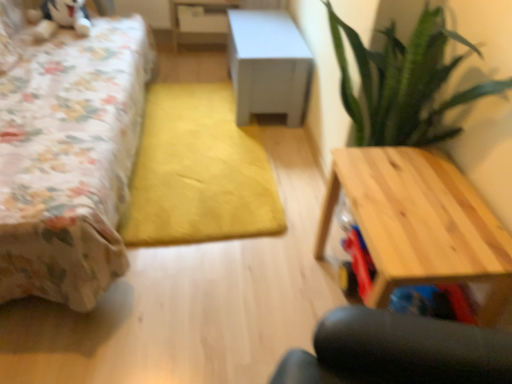
Question: Can you confirm if floral fabric bed at left is thinner than light wood table at right, placed as the third table when sorted from back to front?

Choices:
 (A) yes
 (B) no

Answer: (B)

Question: Does floral fabric bed at left lie in front of light wood table at right, marked as the first table in a front-to-back arrangement?

Choices:
 (A) no
 (B) yes

Answer: (B)

Question: From the image's perspective, is floral fabric bed at left over light wood table at right, the 1th table in the bottom-to-top sequence?

Choices:
 (A) yes
 (B) no

Answer: (A)

Question: Does floral fabric bed at left have a larger size compared to light wood table at right, the 1th table in the bottom-to-top sequence?

Choices:
 (A) no
 (B) yes

Answer: (B)

Question: Considering the relative sizes of floral fabric bed at left and light wood table at right, placed as the third table when sorted from back to front, in the image provided, is floral fabric bed at left taller than light wood table at right, placed as the third table when sorted from back to front,?

Choices:
 (A) no
 (B) yes

Answer: (B)

Question: Would you consider floral fabric bed at left to be distant from light wood table at right, the 1th table in the bottom-to-top sequence?

Choices:
 (A) yes
 (B) no

Answer: (A)

Question: From the image's perspective, is white matte cabinet at center, positioned as the 2th table in back-to-front order, above floral fabric bed at left?

Choices:
 (A) no
 (B) yes

Answer: (B)

Question: Is floral fabric bed at left surrounded by white matte cabinet at center, which is the second table from top to bottom?

Choices:
 (A) no
 (B) yes

Answer: (A)

Question: Considering the relative positions of white matte cabinet at center, positioned as the 2th table in back-to-front order, and floral fabric bed at left in the image provided, is white matte cabinet at center, positioned as the 2th table in back-to-front order, to the right of floral fabric bed at left from the viewer's perspective?

Choices:
 (A) no
 (B) yes

Answer: (B)

Question: Considering the relative sizes of white matte cabinet at center, which is the second table from top to bottom, and floral fabric bed at left in the image provided, is white matte cabinet at center, which is the second table from top to bottom, smaller than floral fabric bed at left?

Choices:
 (A) yes
 (B) no

Answer: (A)

Question: Is white matte cabinet at center, which is the second table from top to bottom, bigger than floral fabric bed at left?

Choices:
 (A) no
 (B) yes

Answer: (A)

Question: Is white matte cabinet at center, positioned as the second table in front-to-back order, facing away from floral fabric bed at left?

Choices:
 (A) yes
 (B) no

Answer: (B)

Question: From a real-world perspective, is white matte cabinet at center, which is the second table from top to bottom, positioned under light wood table at right, which is counted as the third table, starting from the top, based on gravity?

Choices:
 (A) no
 (B) yes

Answer: (B)